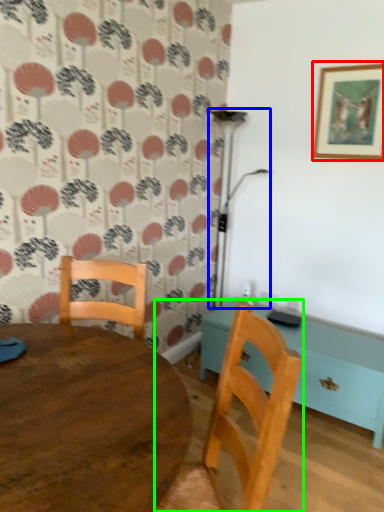
Question: Considering the real-world distances, which object is farthest from picture frame (highlighted by a red box)? lamp (highlighted by a blue box) or chair (highlighted by a green box)?

Choices:
 (A) lamp
 (B) chair

Answer: (B)